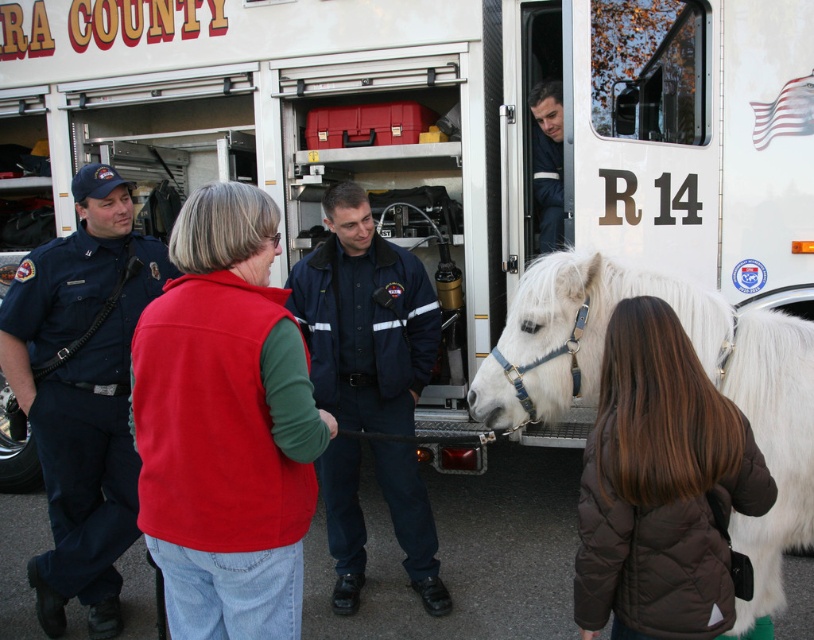
Question: Which of the following is the farthest from the observer?

Choices:
 (A) (340, 493)
 (B) (532, 166)

Answer: (B)

Question: Is white silky horse at right smaller than blue uniform at center?

Choices:
 (A) no
 (B) yes

Answer: (A)

Question: Which of the following is the closest to the observer?

Choices:
 (A) blue uniform at center
 (B) white silky horse at right
 (C) fleece vest at center
 (D) navy blue uniform at center

Answer: (C)

Question: Is fleece vest at center wider than blue uniform at center?

Choices:
 (A) no
 (B) yes

Answer: (B)

Question: Observing the image, what is the correct spatial positioning of dark blue uniform at left in reference to blue uniform at center?

Choices:
 (A) below
 (B) above

Answer: (A)

Question: Which object is farther from the camera taking this photo?

Choices:
 (A) blue uniform at center
 (B) dark blue uniform at left
 (C) fleece vest at center

Answer: (A)